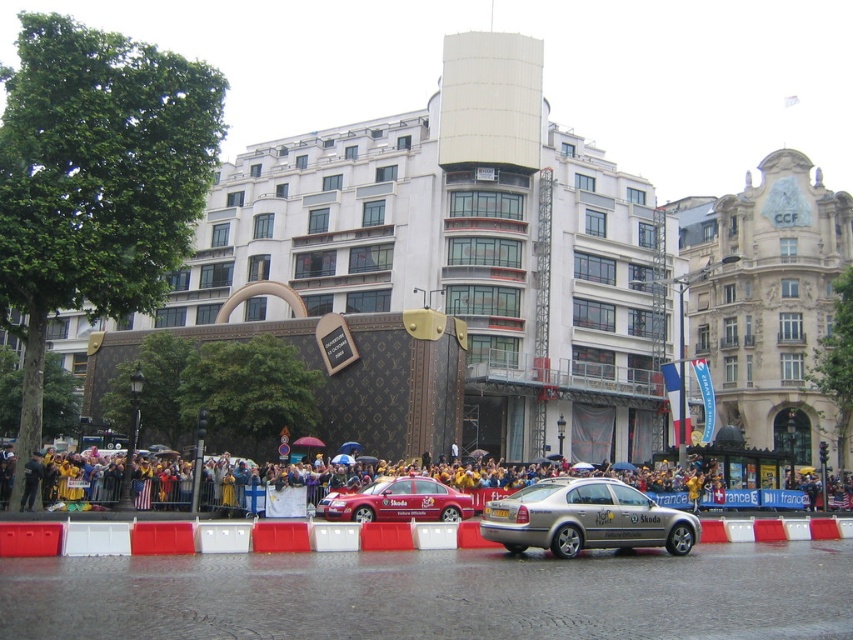
You are standing at the origin point of the coordinate system. You want to walk to the yellow fabric crowd at lower center. What direction should you walk in?

The yellow fabric crowd at lower center is located at coordinate point (364, 480), so you should walk towards the lower right direction from your current position at the origin.